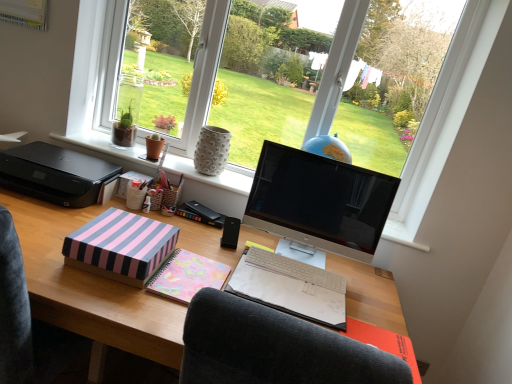
At what (x,y) coordinates should I click in order to perform the action: click on vacant space in between black plastic speaker at center and pastel butterfly-patterned paper at center. Please return your answer as a coordinate pair (x, y). The image size is (512, 384). Looking at the image, I should click on (217, 251).